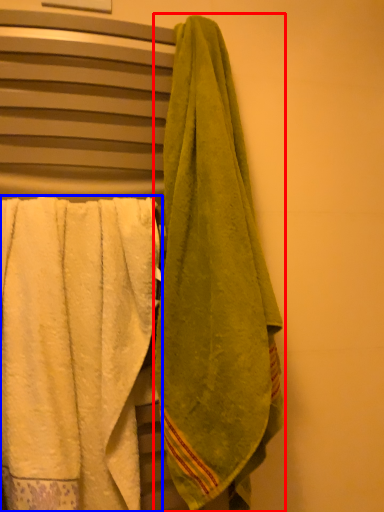
Question: Which object appears farthest to the camera in this image, towel (highlighted by a red box) or towel (highlighted by a blue box)?

Choices:
 (A) towel
 (B) towel

Answer: (B)